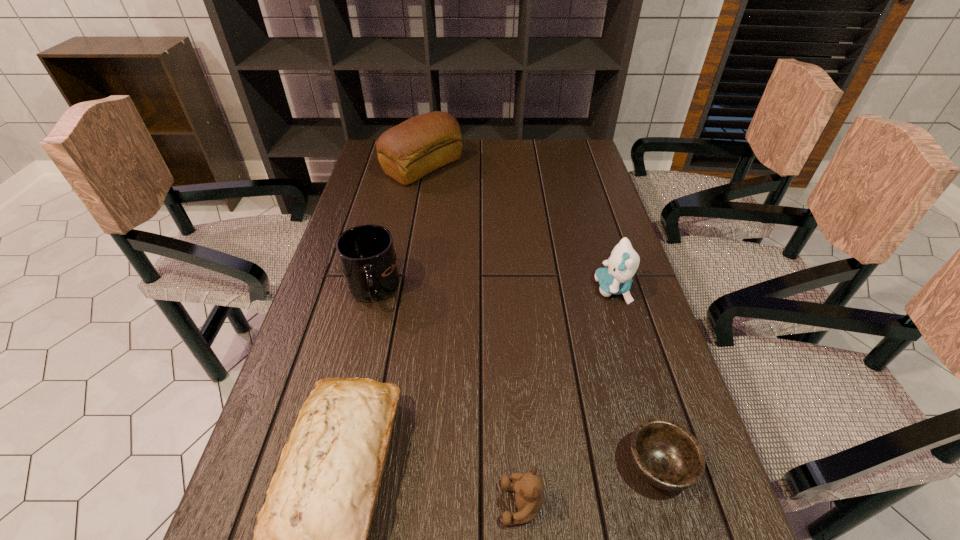
Image resolution: width=960 pixels, height=540 pixels. Find the location of `the tallest object`. the tallest object is located at coordinates (407, 152).

The width and height of the screenshot is (960, 540). What are the coordinates of `the farthest object` in the screenshot? It's located at (407, 152).

The image size is (960, 540). I want to click on kitten, so click(x=623, y=262).

Identify the location of mug. This screenshot has height=540, width=960. (366, 253).

At what (x,y) coordinates should I click in order to perform the action: click on teddy bear. Please return your answer as a coordinate pair (x, y). Looking at the image, I should click on (529, 487).

Locate an element on the screen. The image size is (960, 540). the second shortest object is located at coordinates (529, 487).

I want to click on the shortest object, so click(x=668, y=456).

The height and width of the screenshot is (540, 960). Find the location of `vacant space located 0.280m on the right of the farther bread`. vacant space located 0.280m on the right of the farther bread is located at coordinates (541, 167).

Find the location of a particular element. The image size is (960, 540). free space located 0.280m on the face of the kitten is located at coordinates (486, 289).

Where is `vacant region located on the face of the kitten`? vacant region located on the face of the kitten is located at coordinates (459, 289).